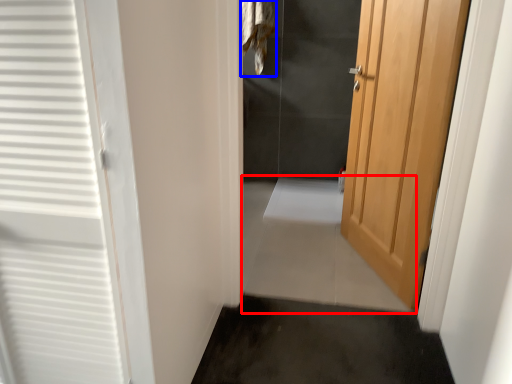
Question: Which point is closer to the camera, path (highlighted by a red box) or laundry (highlighted by a blue box)?

Choices:
 (A) path
 (B) laundry

Answer: (A)